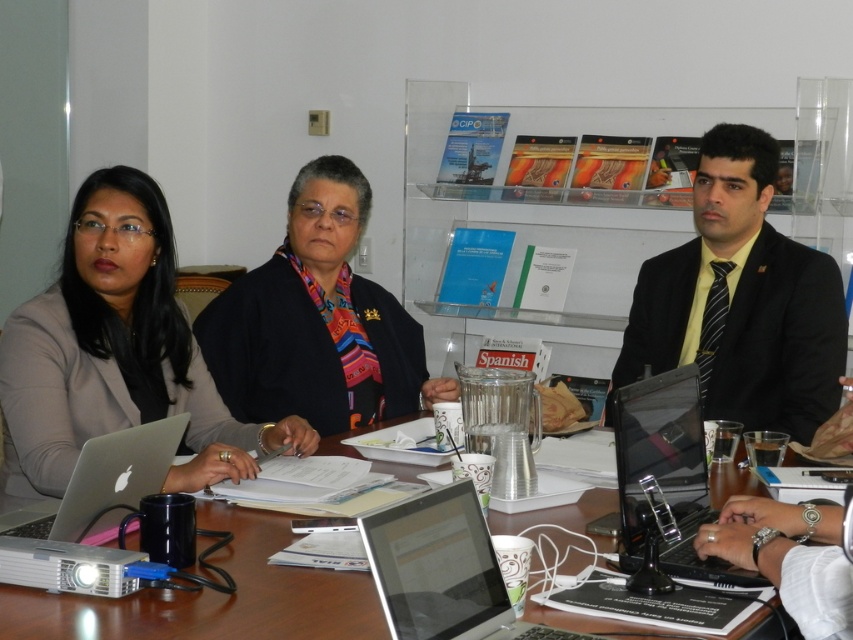
Question: From the image, what is the correct spatial relationship of black suit at right in relation to black glossy laptop at center?

Choices:
 (A) right
 (B) left

Answer: (A)

Question: Can you confirm if black glossy laptop at center is positioned to the left of silver metallic laptop at lower left?

Choices:
 (A) yes
 (B) no

Answer: (B)

Question: Which of the following is the farthest from the observer?

Choices:
 (A) silver metallic laptop at center
 (B) black suit at right
 (C) matte black jacket at upper left

Answer: (B)

Question: Among these objects, which one is nearest to the camera?

Choices:
 (A) white paper at center
 (B) matte black sweater at center
 (C) silver metallic laptop at center
 (D) matte black jacket at upper left

Answer: (C)

Question: Considering the real-world distances, which object is farthest from the silver metallic laptop at lower left?

Choices:
 (A) matte black sweater at center
 (B) matte black jacket at upper left

Answer: (A)

Question: Is matte black jacket at upper left positioned at the back of matte black sweater at center?

Choices:
 (A) no
 (B) yes

Answer: (A)